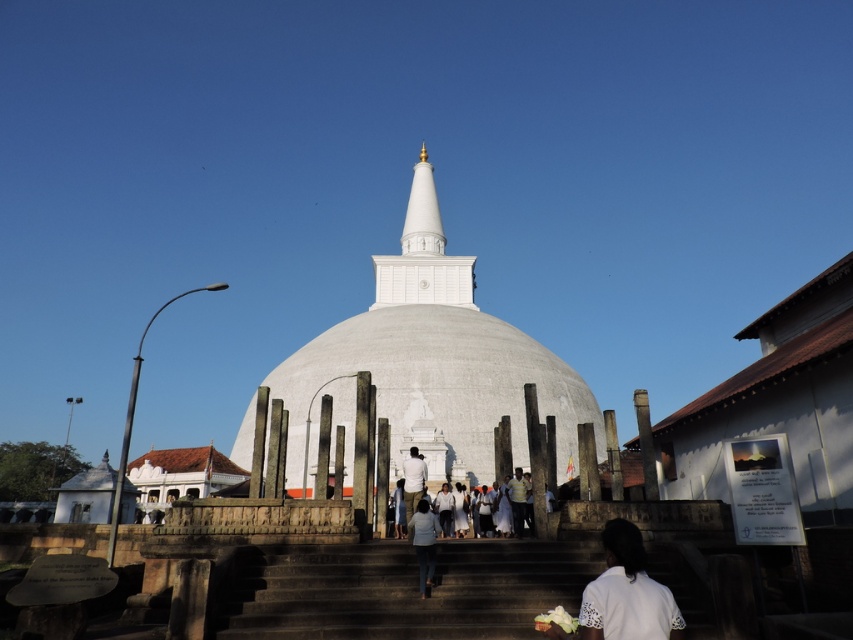
Which is above, dark stone stairs at center or light blue fabric at center?

Positioned higher is light blue fabric at center.

The image size is (853, 640). Identify the location of dark stone stairs at center. tap(407, 589).

I want to click on dark stone stairs at center, so click(x=407, y=589).

Is white smooth stupa at center thinner than light blue fabric at center?

No, white smooth stupa at center is not thinner than light blue fabric at center.

Between point (451, 276) and point (401, 500), which one is positioned in front?

Point (401, 500) is more forward.

The height and width of the screenshot is (640, 853). Identify the location of white smooth stupa at center. (422, 253).

Is white smooth dome at center shorter than dark stone stairs at center?

No, white smooth dome at center is not shorter than dark stone stairs at center.

Locate an element on the screen. Image resolution: width=853 pixels, height=640 pixels. white smooth dome at center is located at coordinates (436, 372).

Identify the location of white smooth dome at center. The image size is (853, 640). (436, 372).